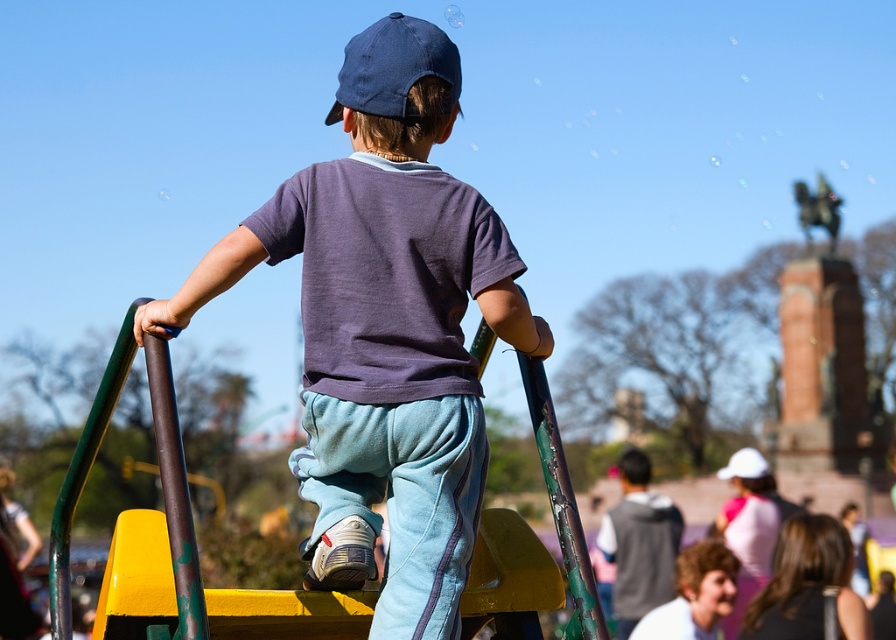
Describe the element at coordinates (385, 328) in the screenshot. I see `matte blue cap at center` at that location.

Looking at this image, who is more forward, (336, 358) or (333, 108)?

Positioned in front is point (336, 358).

The height and width of the screenshot is (640, 896). I want to click on matte blue cap at center, so click(385, 328).